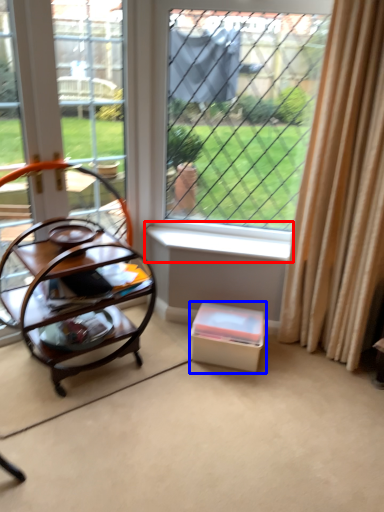
Question: Which object is further to the camera taking this photo, window sill (highlighted by a red box) or storage box (highlighted by a blue box)?

Choices:
 (A) window sill
 (B) storage box

Answer: (A)